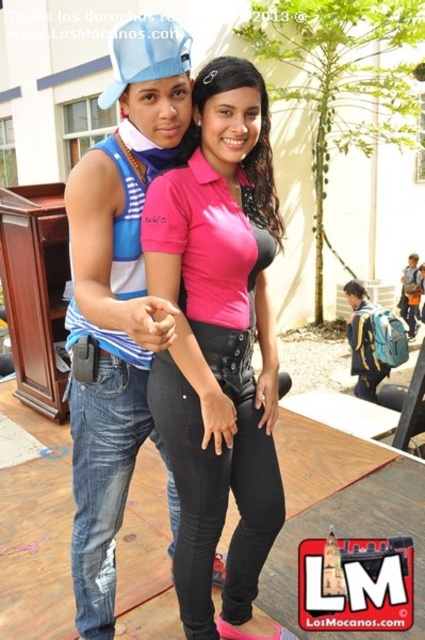
Question: Considering the real-world distances, which object is farthest from the pink matte shirt at center?

Choices:
 (A) blue denim jeans at left
 (B) blue matte baseball cap at upper left

Answer: (B)

Question: Which of the following is the closest to the observer?

Choices:
 (A) (175, 276)
 (B) (181, 58)
 (C) (107, 628)

Answer: (B)

Question: Which point is closer to the camera?

Choices:
 (A) blue denim jeans at left
 (B) blue matte baseball cap at upper left

Answer: (A)

Question: Observing the image, what is the correct spatial positioning of pink matte shirt at center in reference to blue matte baseball cap at upper left?

Choices:
 (A) right
 (B) left

Answer: (A)

Question: Does blue denim jeans at left come behind blue matte baseball cap at upper left?

Choices:
 (A) yes
 (B) no

Answer: (B)

Question: Does blue denim jeans at left appear under blue matte baseball cap at upper left?

Choices:
 (A) yes
 (B) no

Answer: (A)